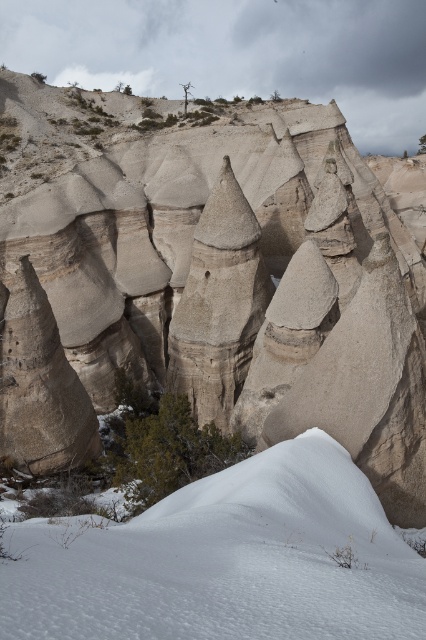
Question: Does smooth sandstone rock formation at center have a lesser width compared to white fluffy snow at lower center?

Choices:
 (A) no
 (B) yes

Answer: (A)

Question: Does smooth sandstone rock formation at center appear under white fluffy snow at lower center?

Choices:
 (A) yes
 (B) no

Answer: (B)

Question: Is smooth sandstone rock formation at center to the right of white fluffy snow at lower center from the viewer's perspective?

Choices:
 (A) no
 (B) yes

Answer: (A)

Question: Among these objects, which one is nearest to the camera?

Choices:
 (A) white fluffy snow at lower center
 (B) smooth sandstone rock formation at center

Answer: (A)